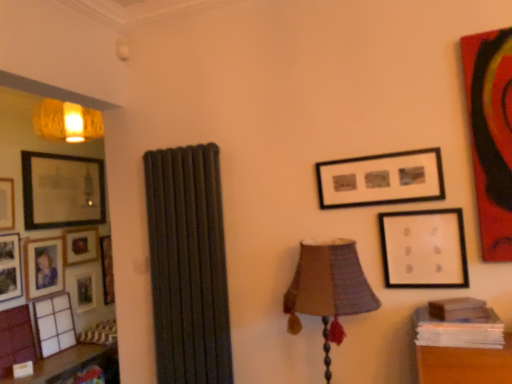
Question: From a real-world perspective, is matte gold picture frame at left, which appears as the 4th picture frame when viewed from the right, located beneath matte wooden picture frame at left, which is the sixth picture frame in left-to-right order?

Choices:
 (A) yes
 (B) no

Answer: (B)

Question: Is matte gold picture frame at left, which is the 5th picture frame in left-to-right order, positioned before matte wooden picture frame at left, which is the sixth picture frame in left-to-right order?

Choices:
 (A) no
 (B) yes

Answer: (B)

Question: Is matte gold picture frame at left, which is the 5th picture frame in left-to-right order, smaller than matte wooden picture frame at left, the 8th picture frame positioned from the front?

Choices:
 (A) yes
 (B) no

Answer: (B)

Question: Are matte gold picture frame at left, which appears as the 4th picture frame when viewed from the right, and matte wooden picture frame at left, the 8th picture frame positioned from the front, making contact?

Choices:
 (A) no
 (B) yes

Answer: (A)

Question: Considering the relative sizes of matte gold picture frame at left, which is the 5th picture frame in left-to-right order, and matte wooden picture frame at left, the 8th picture frame positioned from the front, in the image provided, is matte gold picture frame at left, which is the 5th picture frame in left-to-right order, shorter than matte wooden picture frame at left, the 8th picture frame positioned from the front,?

Choices:
 (A) no
 (B) yes

Answer: (B)

Question: From the image's perspective, is matte gold picture frame at left, which appears as the 4th picture frame when viewed from the right, on top of matte wooden picture frame at left, which is the 3th picture frame from right to left?

Choices:
 (A) no
 (B) yes

Answer: (B)

Question: Can you confirm if matte gold picture frame at left, which appears as the 4th picture frame when viewed from the right, is taller than matte black picture frame at upper right, which is the second picture frame from front to back?

Choices:
 (A) no
 (B) yes

Answer: (B)

Question: Would you say matte gold picture frame at left, placed as the 7th picture frame when sorted from front to back, is outside matte black picture frame at upper right, arranged as the seventh picture frame when viewed from the back?

Choices:
 (A) no
 (B) yes

Answer: (B)

Question: Considering the relative sizes of matte gold picture frame at left, which appears as the 4th picture frame when viewed from the right, and matte black picture frame at upper right, which ranks as the 2th picture frame in right-to-left order, in the image provided, is matte gold picture frame at left, which appears as the 4th picture frame when viewed from the right, shorter than matte black picture frame at upper right, which ranks as the 2th picture frame in right-to-left order,?

Choices:
 (A) yes
 (B) no

Answer: (B)

Question: From the image's perspective, would you say matte gold picture frame at left, which is the second picture frame in back-to-front order, is shown under matte black picture frame at upper right, which is the 7th picture frame in left-to-right order?

Choices:
 (A) yes
 (B) no

Answer: (A)

Question: From a real-world perspective, does matte gold picture frame at left, which appears as the 4th picture frame when viewed from the right, stand above matte black picture frame at upper right, which is the second picture frame from front to back?

Choices:
 (A) yes
 (B) no

Answer: (B)

Question: Can you confirm if matte gold picture frame at left, which appears as the 4th picture frame when viewed from the right, is positioned to the left of matte black picture frame at upper right, which is the second picture frame from front to back?

Choices:
 (A) no
 (B) yes

Answer: (B)

Question: From a real-world perspective, is wooden table at left physically above wooden photo frame at left, which appears as the 7th picture frame when viewed from the right?

Choices:
 (A) yes
 (B) no

Answer: (B)